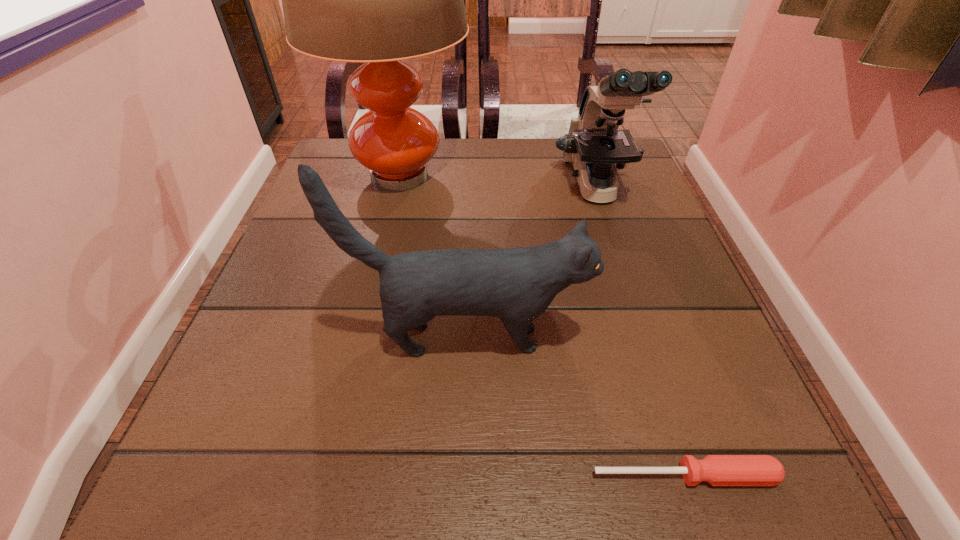
Locate an element on the screen. Image resolution: width=960 pixels, height=540 pixels. the tallest object is located at coordinates (377, 0).

Locate an element on the screen. cat is located at coordinates (518, 284).

Where is `microscope`? The width and height of the screenshot is (960, 540). microscope is located at coordinates (594, 144).

The image size is (960, 540). Find the location of `screwdriver`. screwdriver is located at coordinates (718, 470).

What are the coordinates of `the nearest object` in the screenshot? It's located at (718, 470).

I want to click on vacant region located on the front of the lamp, so click(380, 260).

Locate an element on the screen. This screenshot has height=540, width=960. free space located 0.150m at the face of the cat is located at coordinates (678, 339).

You are a GUI agent. You are given a task and a screenshot of the screen. Output one action in this format:
    pyautogui.click(x=<x>, y=<y>)
    Task: Click on the blank space located 0.190m through the eyepieces of the microscope
    
    Given the screenshot: What is the action you would take?
    pyautogui.click(x=630, y=294)

In order to click on vacant area situated 0.240m on the left of the nearest object in this screenshot , I will do `click(404, 476)`.

Identify the location of lamp present at the far edge. (377, 0).